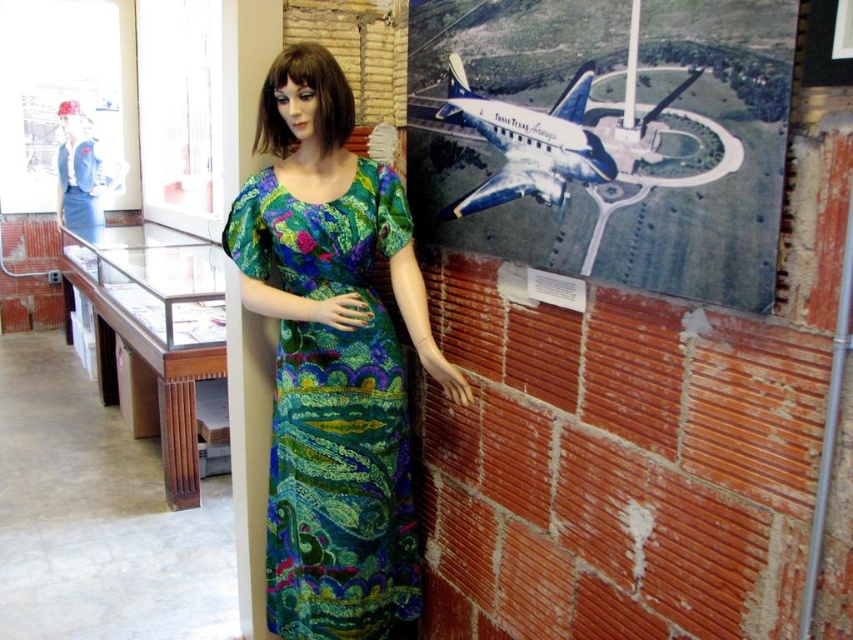
Is metallic airplane at upper right thinner than multicolored printed fabric dress at center?

In fact, metallic airplane at upper right might be wider than multicolored printed fabric dress at center.

Can you confirm if metallic airplane at upper right is positioned to the right of multicolored printed fabric dress at center?

Correct, you'll find metallic airplane at upper right to the right of multicolored printed fabric dress at center.

Does point (769, 129) lie in front of point (286, 515)?

Yes, point (769, 129) is closer to viewer.

Locate an element on the screen. metallic airplane at upper right is located at coordinates (608, 136).